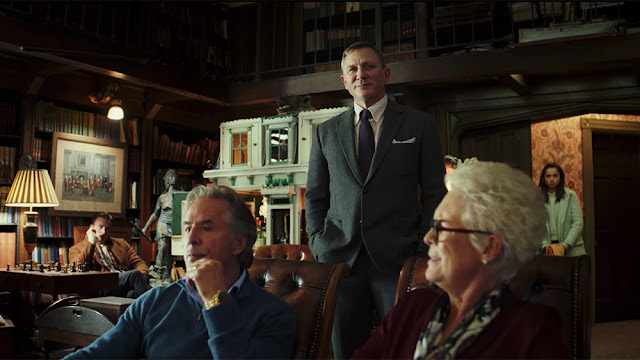
This screenshot has height=360, width=640. In order to click on lampshade in this screenshot , I will do `click(42, 191)`.